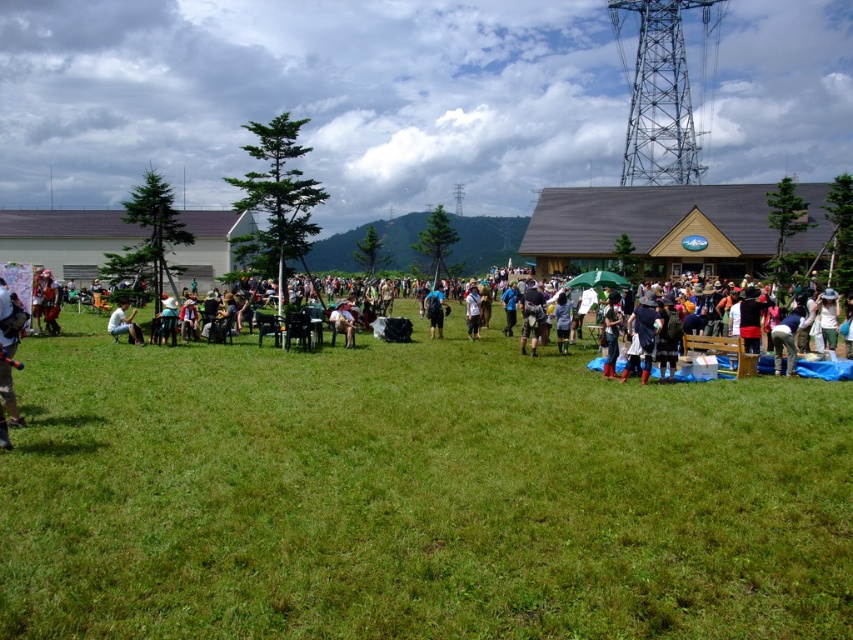
Question: Can you confirm if matte black jacket at center is positioned above blue fabric bag at center?

Choices:
 (A) no
 (B) yes

Answer: (A)

Question: From the image, what is the correct spatial relationship of light brown fabric chair at center in relation to white cotton shirt at center?

Choices:
 (A) right
 (B) left

Answer: (B)

Question: Which point appears farthest from the camera in this image?

Choices:
 (A) (173, 305)
 (B) (467, 532)
 (C) (337, 307)

Answer: (C)

Question: Can you confirm if green grass at center is positioned above matte black jacket at left?

Choices:
 (A) yes
 (B) no

Answer: (B)

Question: Estimate the real-world distances between objects in this image. Which object is closer to the green grass at center?

Choices:
 (A) light brown fabric chair at center
 (B) matte black jacket at center

Answer: (B)

Question: Among these objects, which one is nearest to the camera?

Choices:
 (A) blue fabric bag at center
 (B) light brown fabric chair at center
 (C) green grass at center

Answer: (C)